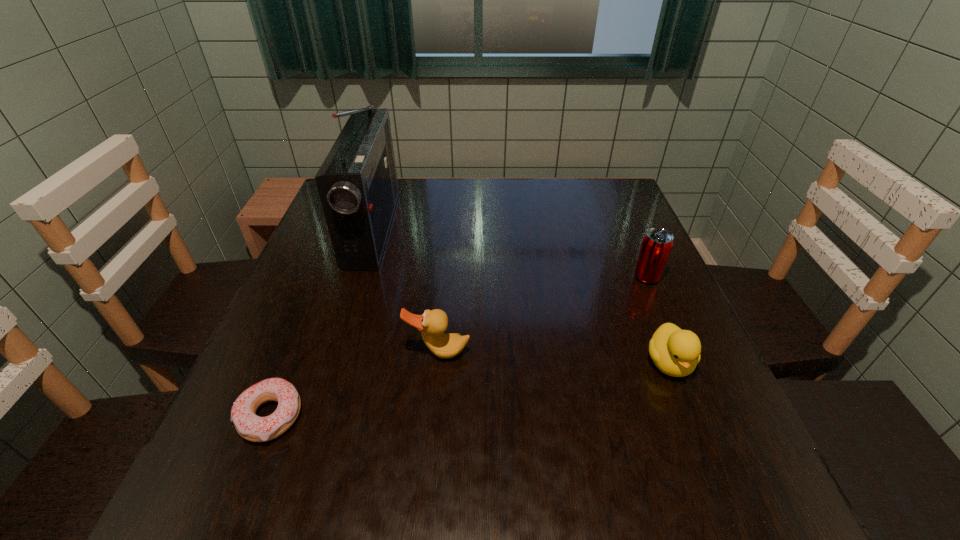
At what (x,y) coordinates should I click in order to perform the action: click on the tallest object. Please return your answer as a coordinate pair (x, y). The image size is (960, 540). Looking at the image, I should click on (357, 183).

Find the location of `soda can`. soda can is located at coordinates (657, 243).

You are a GUI agent. You are given a task and a screenshot of the screen. Output one action in this format:
    pyautogui.click(x=<x>, y=<y>)
    Task: Click on the third object from right to left
    Image resolution: width=960 pixels, height=540 pixels.
    Given the screenshot: What is the action you would take?
    pyautogui.click(x=432, y=323)

The width and height of the screenshot is (960, 540). In order to click on the right duck in this screenshot , I will do `click(676, 352)`.

I want to click on the nearest object, so click(251, 427).

Identify the location of doughnut. (251, 427).

Locate an element on the screen. This screenshot has width=960, height=540. free spot located on the front-facing side of the radio receiver is located at coordinates (518, 228).

Locate an element on the screen. vacant space situated 0.200m on the left of the soda can is located at coordinates (545, 277).

Locate an element on the screen. Image resolution: width=960 pixels, height=540 pixels. blank space located on the beak of the third object from left to right is located at coordinates (429, 450).

In order to click on vacant space located on the front-facing side of the right duck in this screenshot , I will do point(730,514).